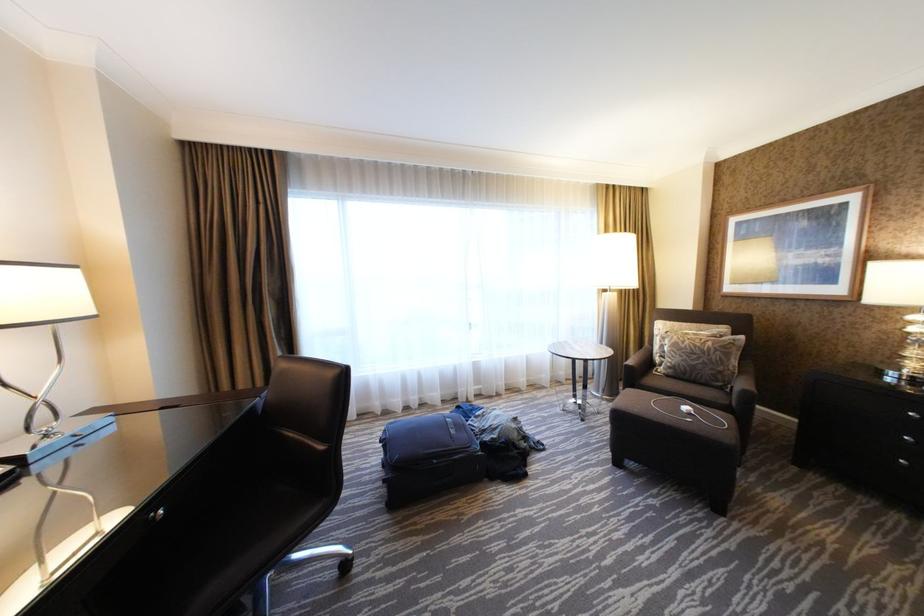
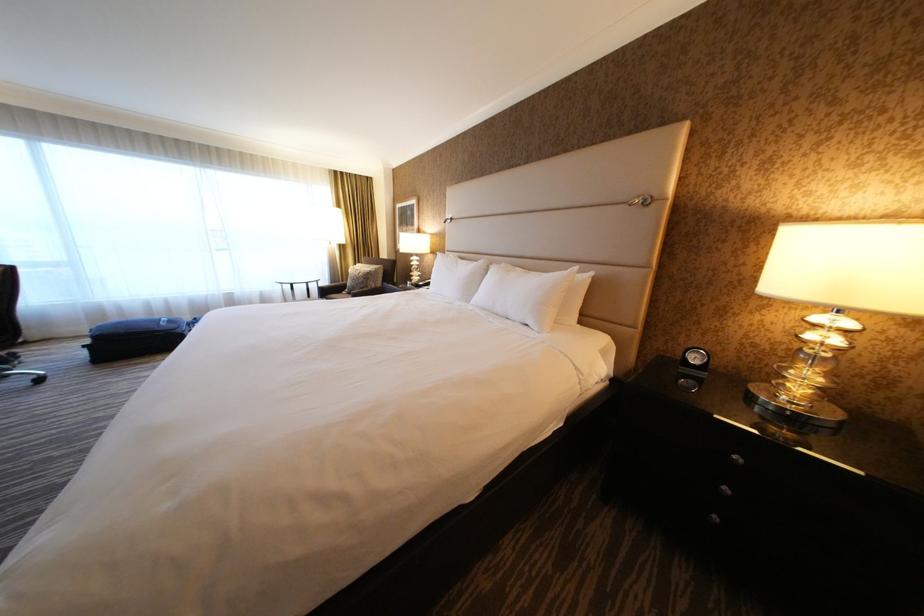
Which direction would the cameraman need to move to produce the second image?

The movement direction of the cameraman is right, backward.